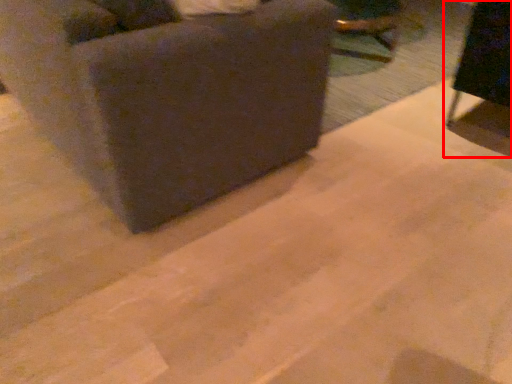
Question: Where is furniture (annotated by the red box) located in relation to furniture in the image?

Choices:
 (A) left
 (B) right

Answer: (B)